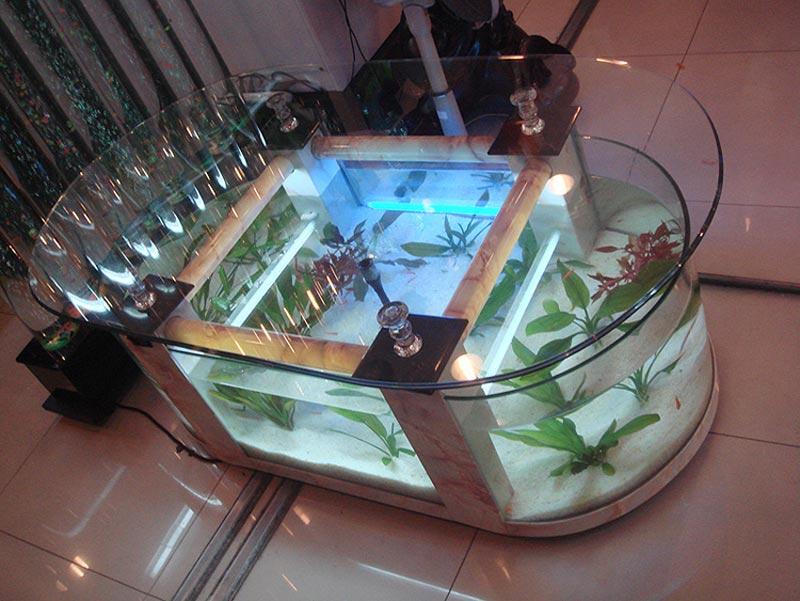
Locate an element on the screen. This screenshot has height=601, width=800. white tile floor is located at coordinates (766, 370).